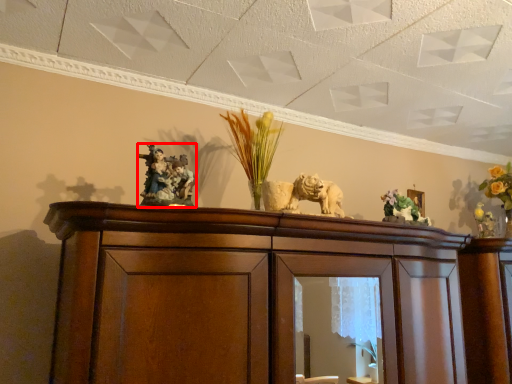
Question: From the image, what is the correct spatial relationship of animal (annotated by the red box) in relation to floral arrangement?

Choices:
 (A) right
 (B) left

Answer: (B)